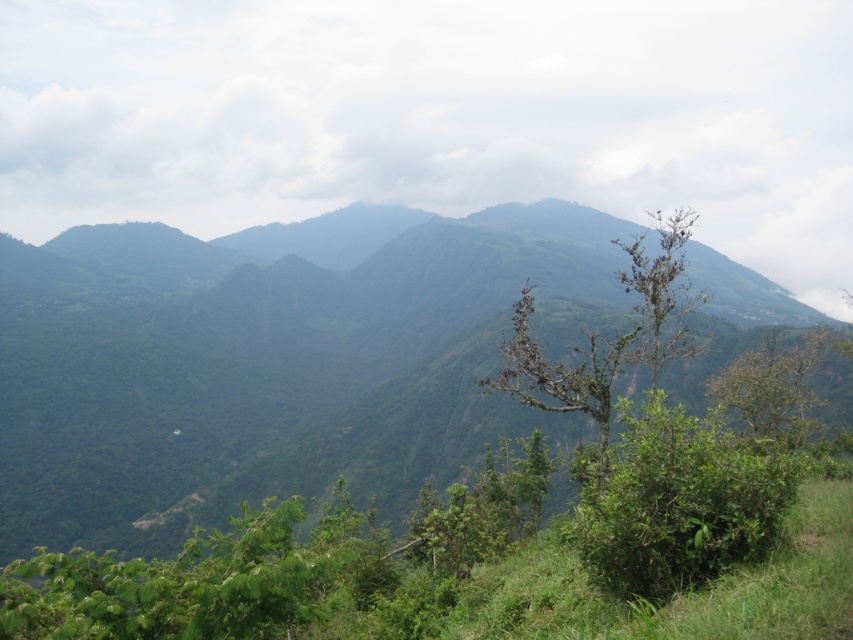
Question: Can you confirm if green leafy mountain at center is positioned above green leafy tree at right?

Choices:
 (A) yes
 (B) no

Answer: (A)

Question: Which point is farther to the camera?

Choices:
 (A) (808, 403)
 (B) (550, 316)

Answer: (B)

Question: Is green leafy mountain at center above green leafy tree at right?

Choices:
 (A) yes
 (B) no

Answer: (A)

Question: Is green leafy mountain at center behind green leafy tree at right?

Choices:
 (A) yes
 (B) no

Answer: (B)

Question: Among these points, which one is nearest to the camera?

Choices:
 (A) (252, 292)
 (B) (737, 404)

Answer: (B)